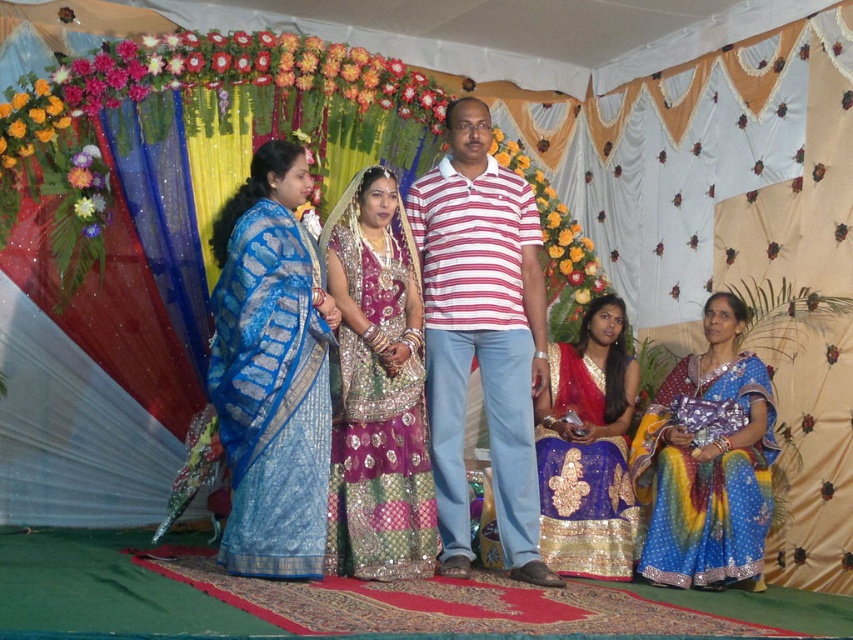
Question: Which point appears farthest from the camera in this image?

Choices:
 (A) (740, 577)
 (B) (338, 556)
 (C) (660, 500)
 (D) (297, 168)

Answer: (C)

Question: Does striped cotton polo shirt at center appear under shiny silk saree at center?

Choices:
 (A) yes
 (B) no

Answer: (B)

Question: Is shiny silk saree at center wider than sparkling sequin saree at center?

Choices:
 (A) yes
 (B) no

Answer: (A)

Question: Which of these objects is positioned closest to the striped cotton polo shirt at center?

Choices:
 (A) shiny silk saree at center
 (B) shiny blue sari at lower right
 (C) blue sequined saree at lower right

Answer: (A)

Question: Is striped cotton polo shirt at center below blue sequined saree at lower right?

Choices:
 (A) no
 (B) yes

Answer: (A)

Question: Which object is closer to the camera taking this photo?

Choices:
 (A) blue sequined saree at lower right
 (B) sparkling sequin saree at center
 (C) striped cotton polo shirt at center

Answer: (B)